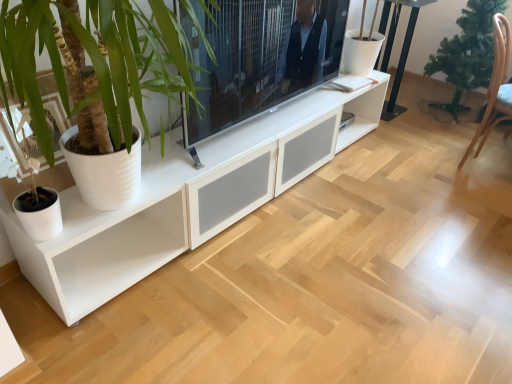
Locate an element on the screen. empty space that is in between black metal table at upper right and brown wooden armchair at right is located at coordinates (423, 134).